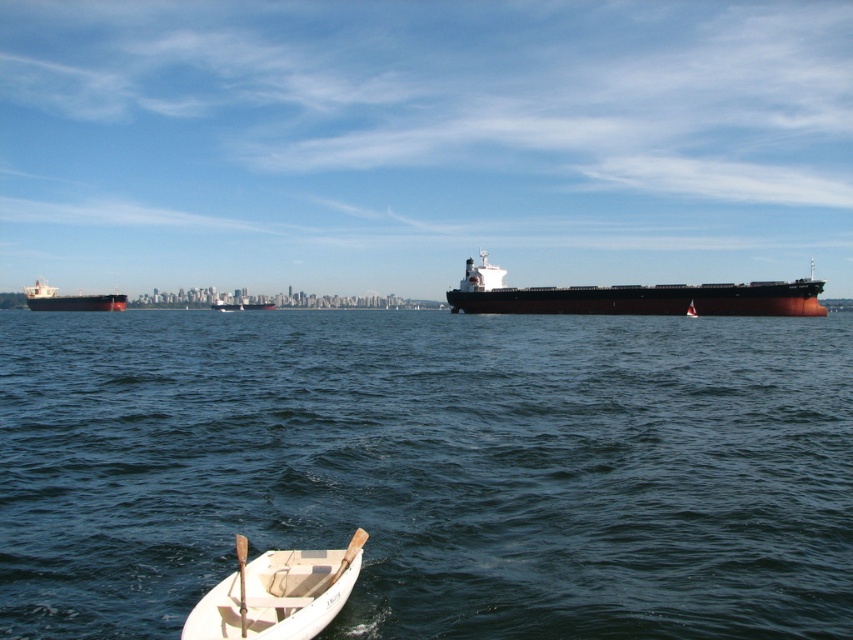
Question: Does dark blue water at center have a greater width compared to dark brown matte cargo ship at center?

Choices:
 (A) yes
 (B) no

Answer: (A)

Question: Which of the following is the farthest from the observer?

Choices:
 (A) 239,592
 (B) 85,298
 (C) 793,291
 (D) 598,348

Answer: (B)

Question: Is matte black ship at left positioned before wooden paddle at lower center?

Choices:
 (A) no
 (B) yes

Answer: (A)

Question: Which is farther from the wooden paddle at lower center?

Choices:
 (A) white matte boat at lower center
 (B) dark blue water at center
 (C) matte black ship at left

Answer: (C)

Question: Which is nearer to the dark blue water at center?

Choices:
 (A) matte black ship at left
 (B) dark brown matte cargo ship at center
 (C) white matte boat at lower center
 (D) wooden paddle at lower center

Answer: (B)

Question: Does matte black ship at left appear on the left side of wooden paddle at lower center?

Choices:
 (A) yes
 (B) no

Answer: (A)